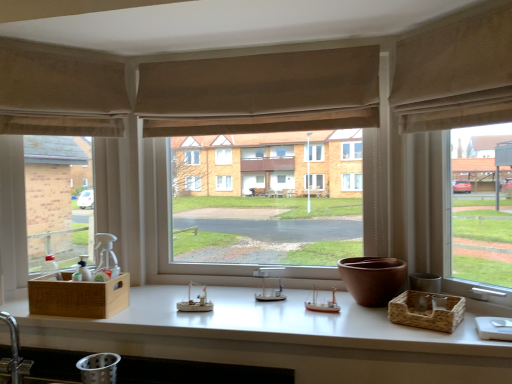
At what (x,y) coordinates should I click in order to perform the action: click on free point above brown woven basket at right, which is the 1th basket from right to left (from a real-world perspective). Please return your answer as a coordinate pair (x, y). Looking at the image, I should click on (419, 298).